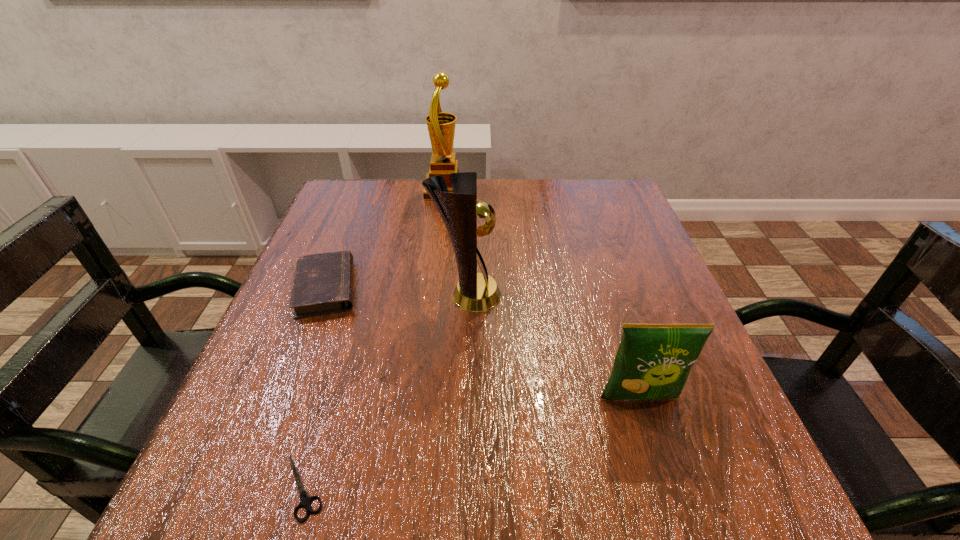
You are a GUI agent. You are given a task and a screenshot of the screen. Output one action in this format:
    pyautogui.click(x=<x>, y=<y>)
    Task: Click on the vacant region between the crisp (potato chip) and the fourth tallest object
    
    Given the screenshot: What is the action you would take?
    pyautogui.click(x=483, y=343)

Find the location of a particular element. vacant area between the nearest object and the farther award is located at coordinates (374, 339).

The height and width of the screenshot is (540, 960). What are the coordinates of `free spot between the nearer award and the rightmost object` in the screenshot? It's located at (553, 347).

Find the location of a particular element. The width and height of the screenshot is (960, 540). object that is the third nearest to the rightmost object is located at coordinates (323, 283).

Locate which object is the third closest to the shortest object. Please provide its 2D coordinates. Your answer should be formatted as a tuple, i.e. [(x, y)], where the tuple contains the x and y coordinates of a point satisfying the conditions above.

[(653, 361)]

Identify the location of vacant space that satisfies the following two spatial constraints: 1. on the front-facing side of the farthest object; 2. on the front side of the shortest object. (411, 488).

This screenshot has width=960, height=540. I want to click on vacant space that satisfies the following two spatial constraints: 1. on the front side of the nearest object; 2. on the left side of the second shortest object, so click(x=249, y=488).